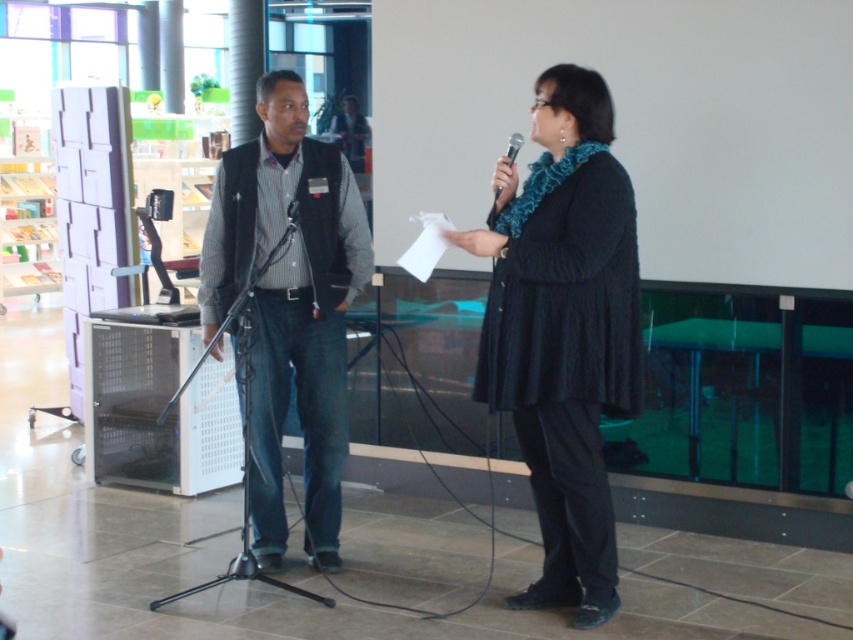
Which is more to the right, black knitted sweater at center or black plastic microphone at upper center?

From the viewer's perspective, black knitted sweater at center appears more on the right side.

Can you confirm if black knitted sweater at center is positioned to the left of black plastic microphone at upper center?

In fact, black knitted sweater at center is to the right of black plastic microphone at upper center.

You are a GUI agent. You are given a task and a screenshot of the screen. Output one action in this format:
    pyautogui.click(x=<x>, y=<y>)
    Task: Click on the black knitted sweater at center
    The width and height of the screenshot is (853, 640).
    Given the screenshot: What is the action you would take?
    pyautogui.click(x=563, y=332)

Identify the location of black knitted sweater at center. The image size is (853, 640). (563, 332).

Which is below, black knitted sweater at center or matte black vest at center?

black knitted sweater at center is lower down.

Does black knitted sweater at center have a greater height compared to matte black vest at center?

No, black knitted sweater at center is not taller than matte black vest at center.

Locate an element on the screen. The width and height of the screenshot is (853, 640). black knitted sweater at center is located at coordinates (563, 332).

Is matte black vest at center shorter than black plastic microphone at upper center?

No, matte black vest at center is not shorter than black plastic microphone at upper center.

Does point (334, 209) come farther from viewer compared to point (509, 148)?

Yes, it is behind point (509, 148).

What do you see at coordinates (289, 305) in the screenshot? The width and height of the screenshot is (853, 640). I see `matte black vest at center` at bounding box center [289, 305].

You are a GUI agent. You are given a task and a screenshot of the screen. Output one action in this format:
    pyautogui.click(x=<x>, y=<y>)
    Task: Click on the matte black vest at center
    
    Given the screenshot: What is the action you would take?
    pyautogui.click(x=289, y=305)